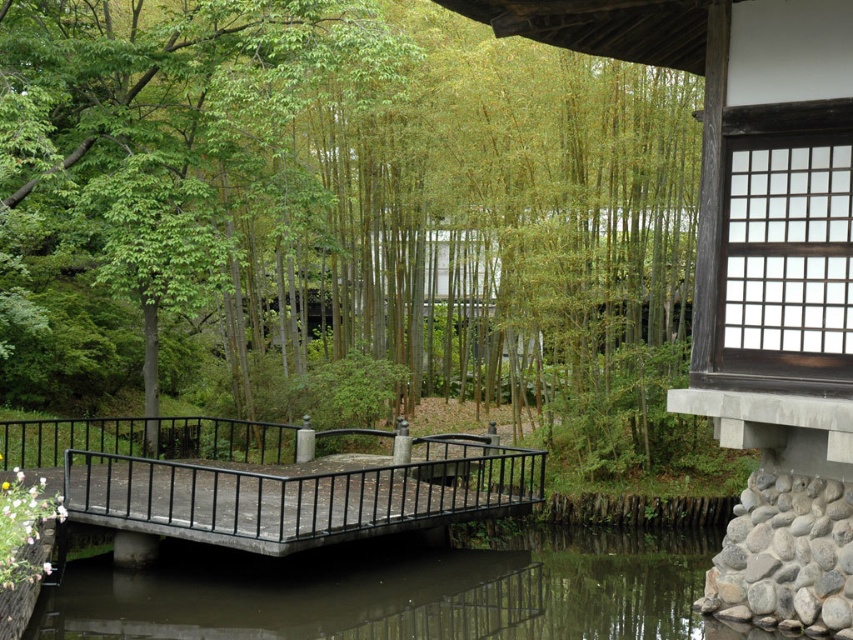
Question: Estimate the real-world distances between objects in this image. Which object is closer to the rustic wood bridge at center?

Choices:
 (A) green bamboo at center
 (B) clear water at bridge center

Answer: (B)

Question: Which object is positioned closest to the rustic wood bridge at center?

Choices:
 (A) green bamboo at center
 (B) clear water at bridge center

Answer: (B)

Question: Is clear water at bridge center further to the viewer compared to rustic wood bridge at center?

Choices:
 (A) yes
 (B) no

Answer: (B)

Question: Is green bamboo at center to the left of rustic wood bridge at center from the viewer's perspective?

Choices:
 (A) yes
 (B) no

Answer: (B)

Question: Which point appears farthest from the camera in this image?

Choices:
 (A) click(x=438, y=474)
 (B) click(x=448, y=572)

Answer: (A)

Question: Can you confirm if green bamboo at center is positioned below clear water at bridge center?

Choices:
 (A) no
 (B) yes

Answer: (A)